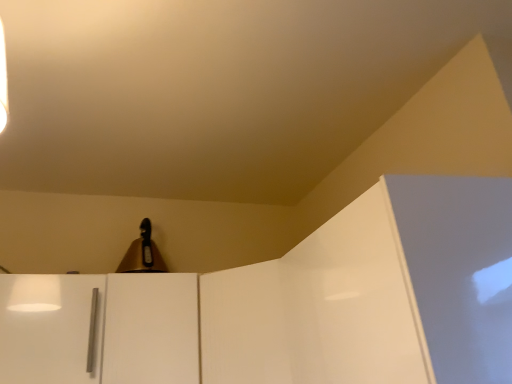
Question: Does white glossy door at center lie behind gold metallic bell at upper center?

Choices:
 (A) no
 (B) yes

Answer: (A)

Question: Considering the relative sizes of white glossy door at center and gold metallic bell at upper center in the image provided, is white glossy door at center smaller than gold metallic bell at upper center?

Choices:
 (A) yes
 (B) no

Answer: (B)

Question: Does white glossy door at center have a lesser height compared to gold metallic bell at upper center?

Choices:
 (A) yes
 (B) no

Answer: (B)

Question: From the image's perspective, is white glossy door at center located above gold metallic bell at upper center?

Choices:
 (A) yes
 (B) no

Answer: (B)

Question: Is white glossy door at center next to gold metallic bell at upper center and touching it?

Choices:
 (A) no
 (B) yes

Answer: (A)

Question: Looking at their shapes, would you say white matte cabinet handle at lower left is wider or thinner than gold metallic bell at upper center?

Choices:
 (A) thin
 (B) wide

Answer: (B)

Question: From their relative heights in the image, would you say white matte cabinet handle at lower left is taller or shorter than gold metallic bell at upper center?

Choices:
 (A) short
 (B) tall

Answer: (B)

Question: From a real-world perspective, relative to gold metallic bell at upper center, is white matte cabinet handle at lower left vertically above or below?

Choices:
 (A) above
 (B) below

Answer: (B)

Question: Considering the positions of point (135, 299) and point (142, 248), is point (135, 299) closer or farther from the camera than point (142, 248)?

Choices:
 (A) farther
 (B) closer

Answer: (B)

Question: Is white glossy door at center taller or shorter than white matte cabinet handle at lower left?

Choices:
 (A) tall
 (B) short

Answer: (A)

Question: In terms of size, does white glossy door at center appear bigger or smaller than white matte cabinet handle at lower left?

Choices:
 (A) small
 (B) big

Answer: (B)

Question: Would you say white glossy door at center is inside or outside white matte cabinet handle at lower left?

Choices:
 (A) outside
 (B) inside

Answer: (A)

Question: Is point [x=125, y=339] closer or farther from the camera than point [x=130, y=362]?

Choices:
 (A) closer
 (B) farther

Answer: (B)

Question: From the image's perspective, is gold metallic bell at upper center located above or below white matte cabinet handle at lower left?

Choices:
 (A) below
 (B) above

Answer: (B)

Question: Is point (147, 264) positioned closer to the camera than point (156, 297)?

Choices:
 (A) farther
 (B) closer

Answer: (A)